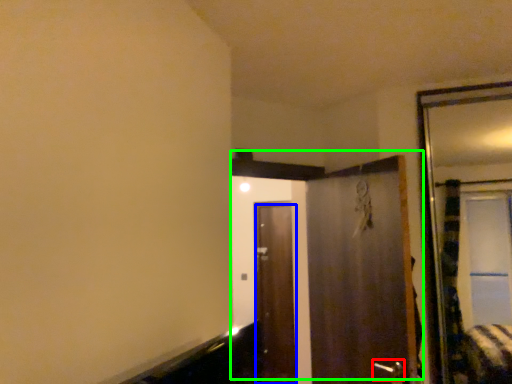
Question: Estimate the real-world distances between objects in this image. Which object is farther from door handle (highlighted by a red box), door (highlighted by a blue box) or door (highlighted by a green box)?

Choices:
 (A) door
 (B) door

Answer: (A)